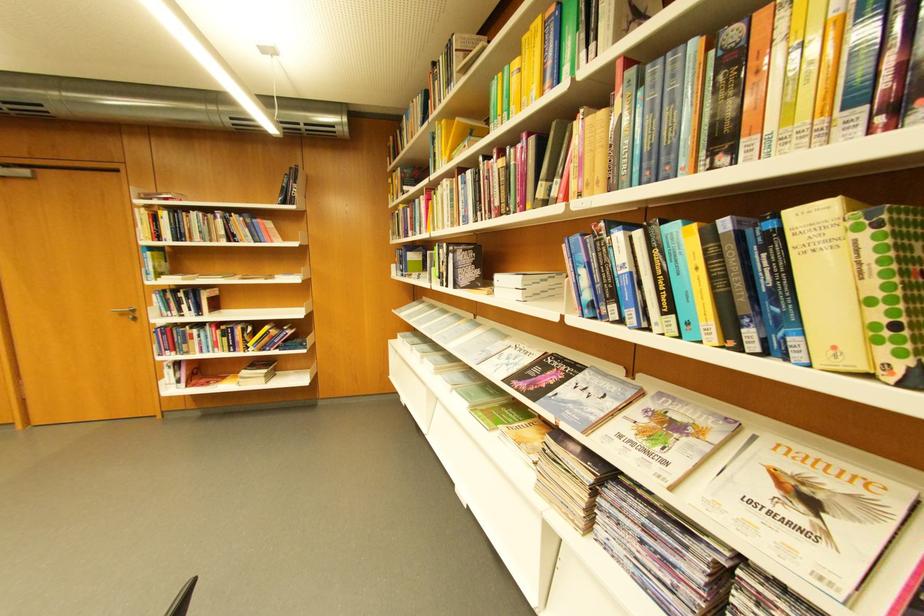
I want to click on green patterned book, so click(891, 288).